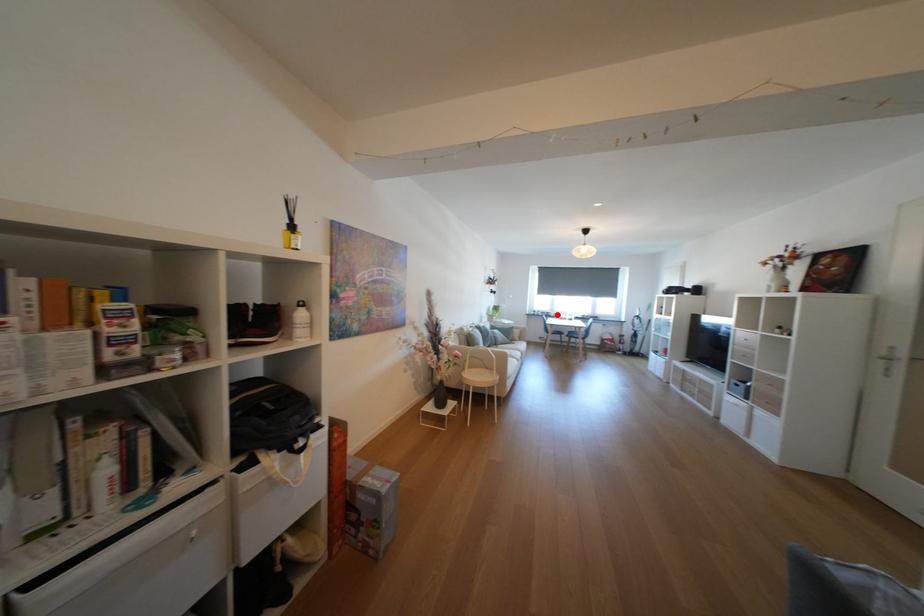
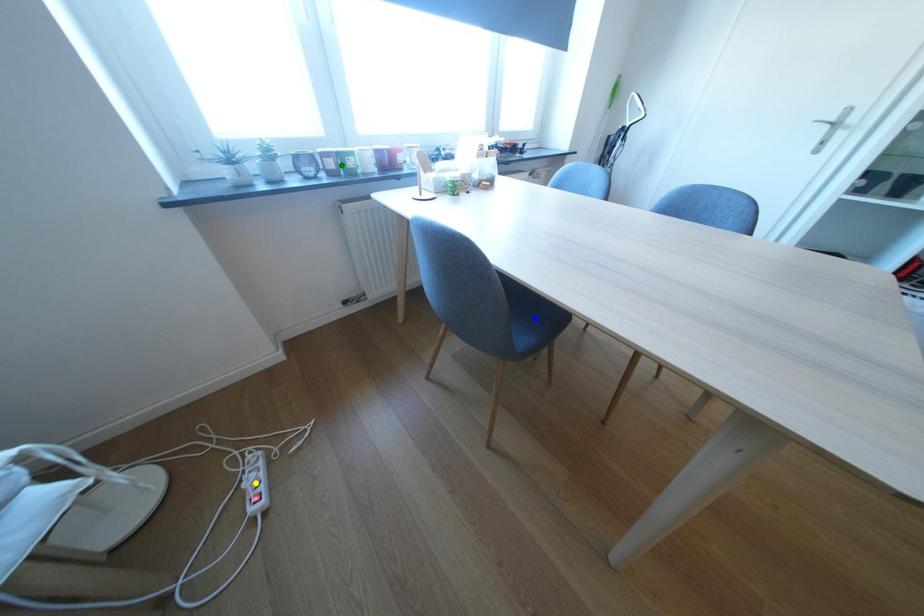
Question: I am providing you with two images of the same scene from different viewpoints. A red point is marked on the first image. You are given multiple points on the second image. Which spot in image 2 lines up with the point in image 1?

Choices:
 (A) green point
 (B) yellow point
 (C) blue point

Answer: (A)